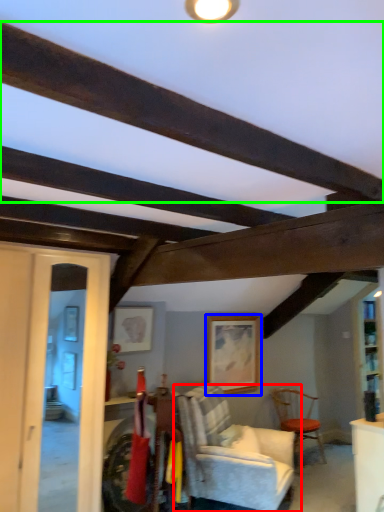
Question: Which object is positioned farthest from chair (highlighted by a red box)? Select from picture frame (highlighted by a blue box) and plank (highlighted by a green box).

Choices:
 (A) picture frame
 (B) plank

Answer: (B)